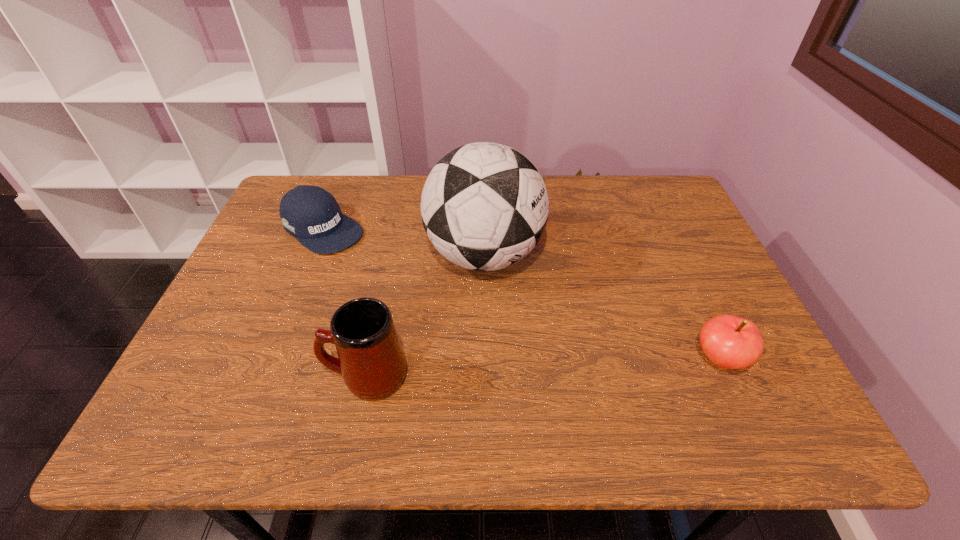
The width and height of the screenshot is (960, 540). What are the coordinates of `free spot between the third object from right to left and the soccer ball` in the screenshot? It's located at (425, 315).

This screenshot has height=540, width=960. I want to click on free space between the baseball cap and the second object from right to left, so click(x=403, y=242).

At what (x,y) coordinates should I click in order to perform the action: click on free spot between the mug and the rightmost object. Please return your answer as a coordinate pair (x, y). Looking at the image, I should click on (542, 368).

The height and width of the screenshot is (540, 960). Find the location of `vacant area between the apple and the tallest object`. vacant area between the apple and the tallest object is located at coordinates (602, 307).

I want to click on free space between the apple and the mug, so click(542, 368).

At what (x,y) coordinates should I click in order to perform the action: click on empty location between the soccer ball and the baseball cap. Please return your answer as a coordinate pair (x, y). Image resolution: width=960 pixels, height=540 pixels. Looking at the image, I should click on (403, 242).

At what (x,y) coordinates should I click in order to perform the action: click on free space between the rightmost object and the baseball cap. Please return your answer as a coordinate pair (x, y). Image resolution: width=960 pixels, height=540 pixels. Looking at the image, I should click on (521, 294).

At what (x,y) coordinates should I click in order to perform the action: click on free point between the apple and the third shortest object. Please return your answer as a coordinate pair (x, y). This screenshot has width=960, height=540. Looking at the image, I should click on (542, 368).

Find the location of a particular element. vacant space in between the apple and the shortest object is located at coordinates point(521,294).

Locate an element on the screen. Image resolution: width=960 pixels, height=540 pixels. object that can be found as the second closest to the leftmost object is located at coordinates (370, 358).